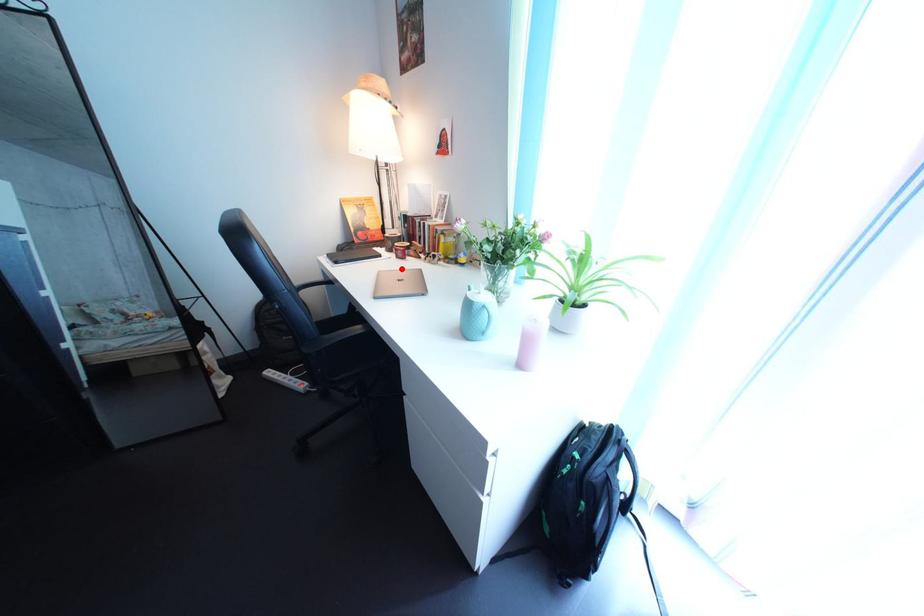
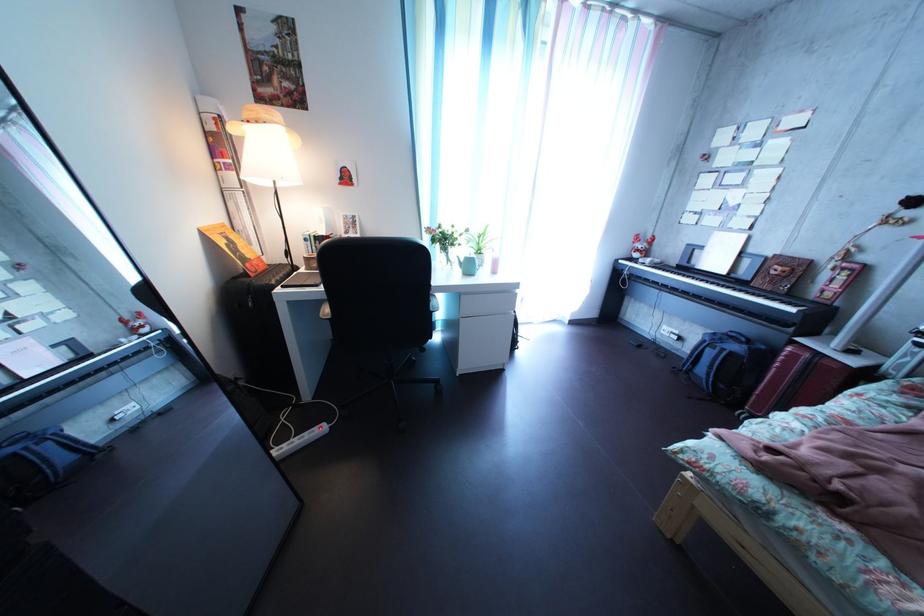
Question: I am providing you with two images of the same scene from different viewpoints. A red point is marked on the first image. Is the red point's position out of view in image 2?

Choices:
 (A) Yes
 (B) No

Answer: (A)